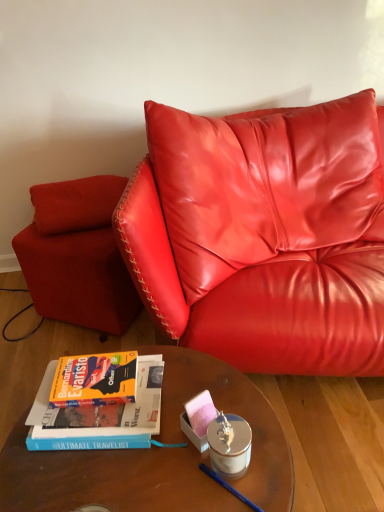
Locate an element on the screen. This screenshot has height=512, width=384. free point to the right of hardcover book at lower left is located at coordinates (221, 401).